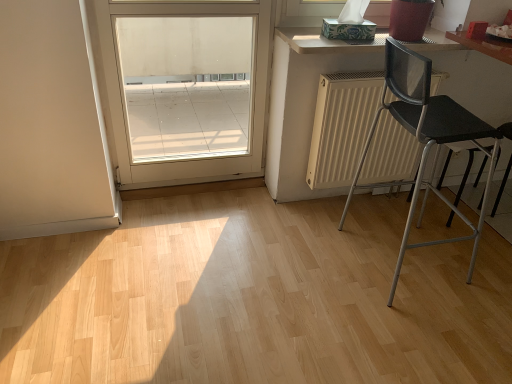
The image size is (512, 384). In order to click on white matte radiator at center in this screenshot , I will do [x=341, y=126].

What do you see at coordinates (327, 41) in the screenshot? The image size is (512, 384). I see `light wood countertop at upper right` at bounding box center [327, 41].

What is the approximate width of black mesh chair at right?

black mesh chair at right is 18.68 inches in width.

The image size is (512, 384). Identify the location of white glossy door at upper left. (185, 88).

Find the location of `white matte radiator at center`. white matte radiator at center is located at coordinates (341, 126).

At what (x,y) coordinates should I click in order to perform the action: click on chair lying on the right of light wood countertop at upper right. Please return your answer as a coordinate pair (x, y). The height and width of the screenshot is (384, 512). Looking at the image, I should click on (425, 139).

Can you confirm if black mesh chair at right is shorter than light wood countertop at upper right?

No.

From a real-world perspective, is black mesh chair at right under light wood countertop at upper right?

Correct, in the physical world, black mesh chair at right is lower than light wood countertop at upper right.

Considering the positions of objects black mesh chair at right and light wood countertop at upper right in the image provided, who is behind, black mesh chair at right or light wood countertop at upper right?

light wood countertop at upper right is further away from the camera.

Considering their positions, is white matte radiator at center located in front of or behind black mesh chair at right?

Clearly, white matte radiator at center is behind black mesh chair at right.

In the scene shown: Between white matte radiator at center and black mesh chair at right, which one has smaller size?

white matte radiator at center.

Can you confirm if white matte radiator at center is wider than black mesh chair at right?

No, white matte radiator at center is not wider than black mesh chair at right.

Does white matte radiator at center have a lesser height compared to black mesh chair at right?

Correct, white matte radiator at center is not as tall as black mesh chair at right.

Can you tell me how much white glossy door at upper left and black mesh chair at right differ in facing direction?

The angle between the facing direction of white glossy door at upper left and the facing direction of black mesh chair at right is 90 degrees.

Considering the sizes of objects white glossy door at upper left and black mesh chair at right in the image provided, who is taller, white glossy door at upper left or black mesh chair at right?

Standing taller between the two is white glossy door at upper left.

Between white glossy door at upper left and black mesh chair at right, which one has larger width?

With larger width is black mesh chair at right.

From the image's perspective, is white glossy door at upper left located above or below black mesh chair at right?

white glossy door at upper left is above black mesh chair at right.

Which object is further away from the camera, black mesh chair at right or white glossy door at upper left?

white glossy door at upper left is further away from the camera.

Which object is positioned more to the left, black mesh chair at right or white glossy door at upper left?

white glossy door at upper left.

Is black mesh chair at right spatially inside white glossy door at upper left, or outside of it?

The correct answer is: outside.

Between black mesh chair at right and white glossy door at upper left, which one has less height?

black mesh chair at right.

Is point (195, 22) closer to viewer compared to point (380, 36)?

No, (195, 22) is behind (380, 36).

Is white glossy door at upper left turned away from light wood countertop at upper right?

white glossy door at upper left does not have its back to light wood countertop at upper right.

Image resolution: width=512 pixels, height=384 pixels. In order to click on counter top that appears above the white glossy door at upper left (from a real-world perspective) in this screenshot , I will do `click(327, 41)`.

From a real-world perspective, is light wood countertop at upper right located beneath white glossy door at upper left?

No, from a real-world perspective, light wood countertop at upper right is not below white glossy door at upper left.

Considering the relative sizes of light wood countertop at upper right and white glossy door at upper left in the image provided, is light wood countertop at upper right thinner than white glossy door at upper left?

No, light wood countertop at upper right is not thinner than white glossy door at upper left.

Is point (416, 45) positioned in front of point (258, 94)?

Yes.

Is white glossy door at upper left facing away from white matte radiator at center?

No.

Can you tell me how much white glossy door at upper left and white matte radiator at center differ in facing direction?

The angular difference between white glossy door at upper left and white matte radiator at center is 0.00013 degrees.

Is white glossy door at upper left not inside white matte radiator at center?

Indeed, white glossy door at upper left is completely outside white matte radiator at center.

Does point (227, 41) come in front of point (369, 171)?

No.

Locate an element on the screen. Image resolution: width=512 pixels, height=384 pixels. counter top on the left of the black mesh chair at right is located at coordinates (327, 41).

The height and width of the screenshot is (384, 512). What are the coordinates of `radiator behind the black mesh chair at right` in the screenshot? It's located at (341, 126).

From the picture: When comparing their distances from black mesh chair at right, does light wood countertop at upper right or white glossy door at upper left seem closer?

Based on the image, light wood countertop at upper right appears to be nearer to black mesh chair at right.

From the image, which object appears to be nearer to black mesh chair at right, white glossy door at upper left or light wood countertop at upper right?

light wood countertop at upper right lies closer to black mesh chair at right than the other object.

Considering their positions, is white matte radiator at center positioned further to black mesh chair at right than light wood countertop at upper right?

Among the two, light wood countertop at upper right is located further to black mesh chair at right.

Considering their positions, is white matte radiator at center positioned further to white glossy door at upper left than light wood countertop at upper right?

light wood countertop at upper right is further to white glossy door at upper left.

When comparing their distances from light wood countertop at upper right, does black mesh chair at right or white matte radiator at center seem closer?

Among the two, white matte radiator at center is located nearer to light wood countertop at upper right.

From the image, which object appears to be farther from white matte radiator at center, white glossy door at upper left or black mesh chair at right?

The object further to white matte radiator at center is white glossy door at upper left.

Based on their spatial positions, is white glossy door at upper left or white matte radiator at center closer to black mesh chair at right?

white matte radiator at center.

In the scene shown: Looking at the image, which one is located further to white glossy door at upper left, white matte radiator at center or black mesh chair at right?

black mesh chair at right.

Image resolution: width=512 pixels, height=384 pixels. Identify the location of counter top positioned between black mesh chair at right and white matte radiator at center from near to far. click(327, 41).

Locate an element on the screen. This screenshot has width=512, height=384. radiator situated between white glossy door at upper left and black mesh chair at right from left to right is located at coordinates (341, 126).

Image resolution: width=512 pixels, height=384 pixels. Find the location of `counter top located between white glossy door at upper left and black mesh chair at right in the left-right direction`. counter top located between white glossy door at upper left and black mesh chair at right in the left-right direction is located at coordinates (327, 41).

At what (x,y) coordinates should I click in order to perform the action: click on counter top between white glossy door at upper left and white matte radiator at center. Please return your answer as a coordinate pair (x, y). The width and height of the screenshot is (512, 384). Looking at the image, I should click on (327, 41).